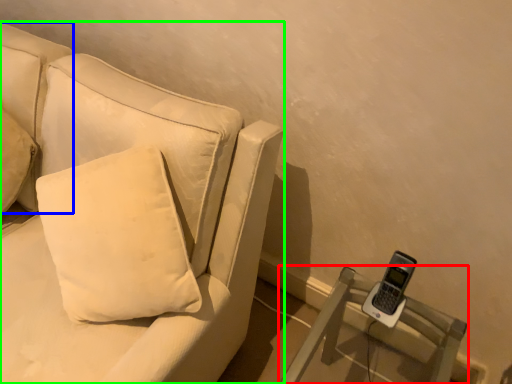
Question: Estimate the real-world distances between objects in this image. Which object is farther from furniture (highlighted by a red box), pillow (highlighted by a blue box) or studio couch (highlighted by a green box)?

Choices:
 (A) pillow
 (B) studio couch

Answer: (A)